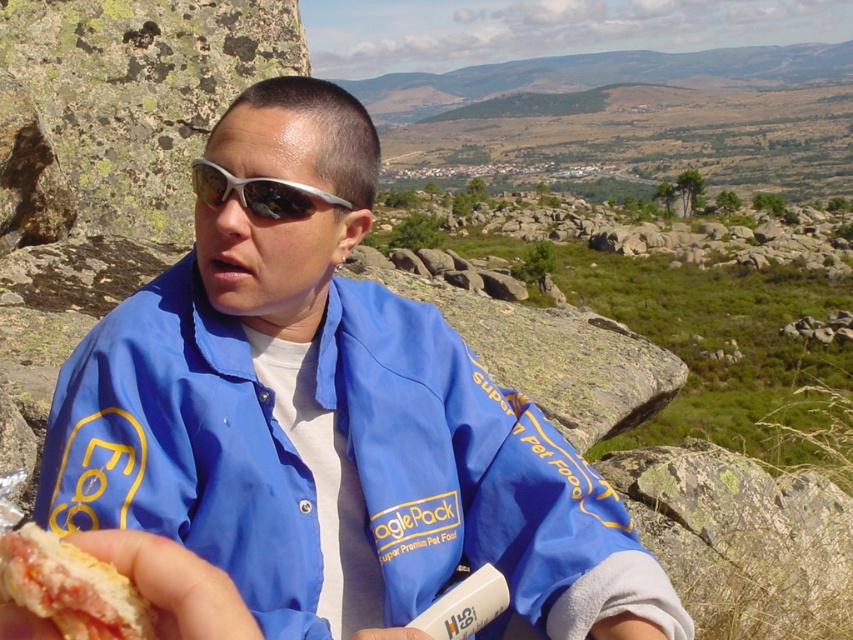
Does blue fabric jacket at center lie in front of silver reflective sunglasses at center?

Yes, blue fabric jacket at center is in front of silver reflective sunglasses at center.

Can you confirm if blue fabric jacket at center is thinner than silver reflective sunglasses at center?

In fact, blue fabric jacket at center might be wider than silver reflective sunglasses at center.

Locate an element on the screen. This screenshot has width=853, height=640. blue fabric jacket at center is located at coordinates [x=329, y=422].

The image size is (853, 640). I want to click on blue fabric jacket at center, so click(x=329, y=422).

Between white bread hot dog at lower left and silver reflective sunglasses at center, which one has more height?

silver reflective sunglasses at center is taller.

Can you confirm if white bread hot dog at lower left is positioned to the left of silver reflective sunglasses at center?

In fact, white bread hot dog at lower left is to the right of silver reflective sunglasses at center.

Locate an element on the screen. white bread hot dog at lower left is located at coordinates (71, 588).

Which is above, blue fabric jacket at center or white bread hot dog at lower left?

white bread hot dog at lower left is above.

Which is in front, point (236, 385) or point (136, 609)?

Positioned in front is point (136, 609).

The image size is (853, 640). What do you see at coordinates (329, 422) in the screenshot?
I see `blue fabric jacket at center` at bounding box center [329, 422].

I want to click on blue fabric jacket at center, so click(x=329, y=422).